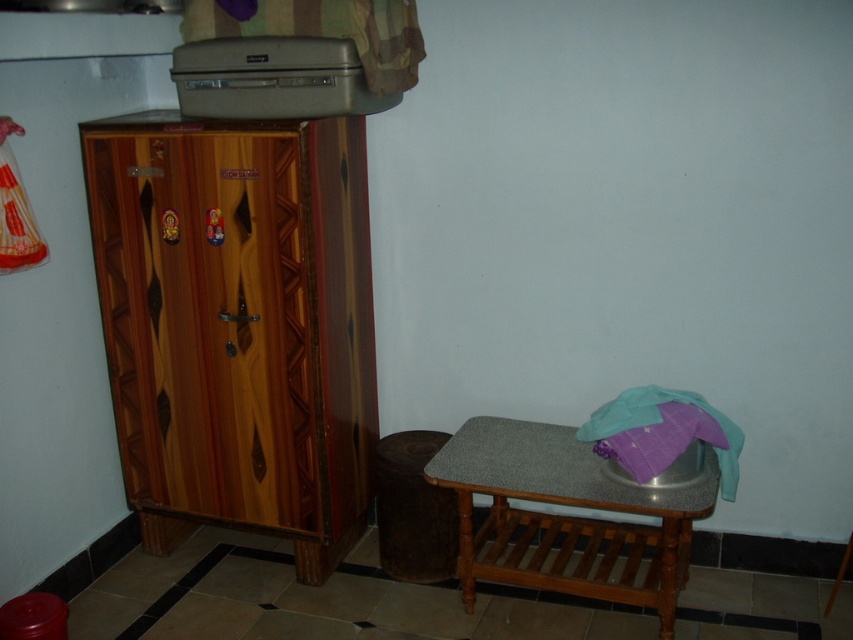
Question: Which of the following is the closest to the observer?

Choices:
 (A) wooden wardrobe at left
 (B) granite top wooden table at lower right

Answer: (B)

Question: Is wooden wardrobe at left closer to the viewer compared to granite top wooden table at lower right?

Choices:
 (A) yes
 (B) no

Answer: (B)

Question: Which point appears farthest from the camera in this image?

Choices:
 (A) (306, 168)
 (B) (595, 596)

Answer: (B)

Question: Which point is closer to the camera?

Choices:
 (A) (566, 528)
 (B) (132, 397)

Answer: (B)

Question: Does wooden wardrobe at left appear on the right side of granite top wooden table at lower right?

Choices:
 (A) no
 (B) yes

Answer: (A)

Question: Does wooden wardrobe at left have a smaller size compared to granite top wooden table at lower right?

Choices:
 (A) yes
 (B) no

Answer: (B)